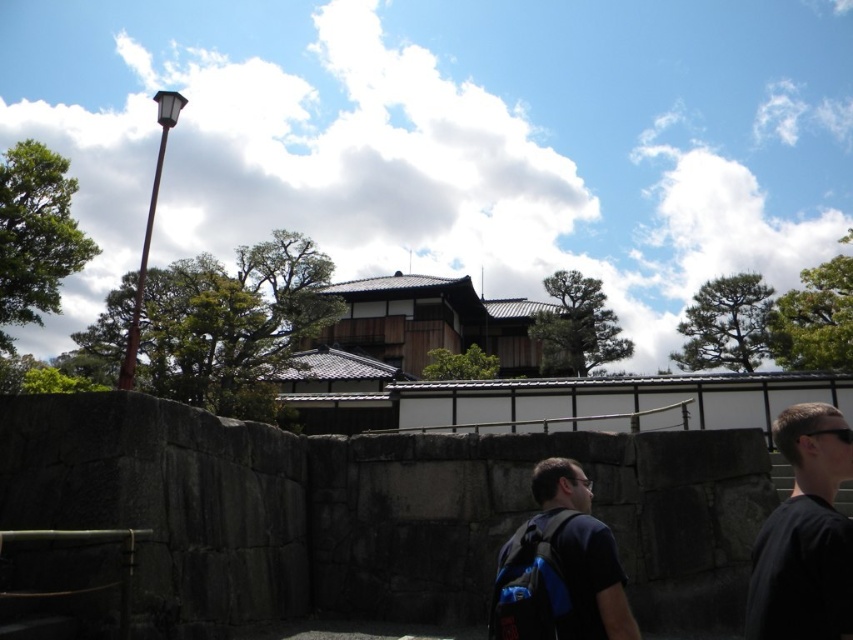
Question: Does dark blue backpack at center have a greater width compared to brown wooden temple at center?

Choices:
 (A) yes
 (B) no

Answer: (B)

Question: Which point appears closest to the camera in this image?

Choices:
 (A) (840, 564)
 (B) (572, 481)

Answer: (A)

Question: Which object is the closest to the dark blue backpack at center?

Choices:
 (A) brown wooden temple at center
 (B) black fabric shirt at right

Answer: (B)

Question: Among these points, which one is farthest from the camera?

Choices:
 (A) (421, 342)
 (B) (848, 580)
 (C) (527, 525)

Answer: (A)

Question: Is black fabric shirt at right bigger than brown wooden temple at center?

Choices:
 (A) yes
 (B) no

Answer: (B)

Question: Does black fabric shirt at right have a larger size compared to brown wooden temple at center?

Choices:
 (A) no
 (B) yes

Answer: (A)